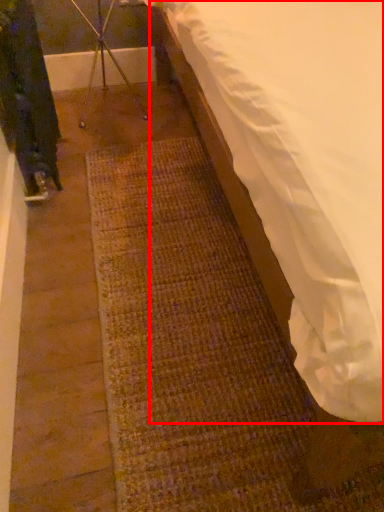
Question: From the image's perspective, what is the correct spatial positioning of mattress (annotated by the red box) in reference to tripod?

Choices:
 (A) above
 (B) below

Answer: (B)